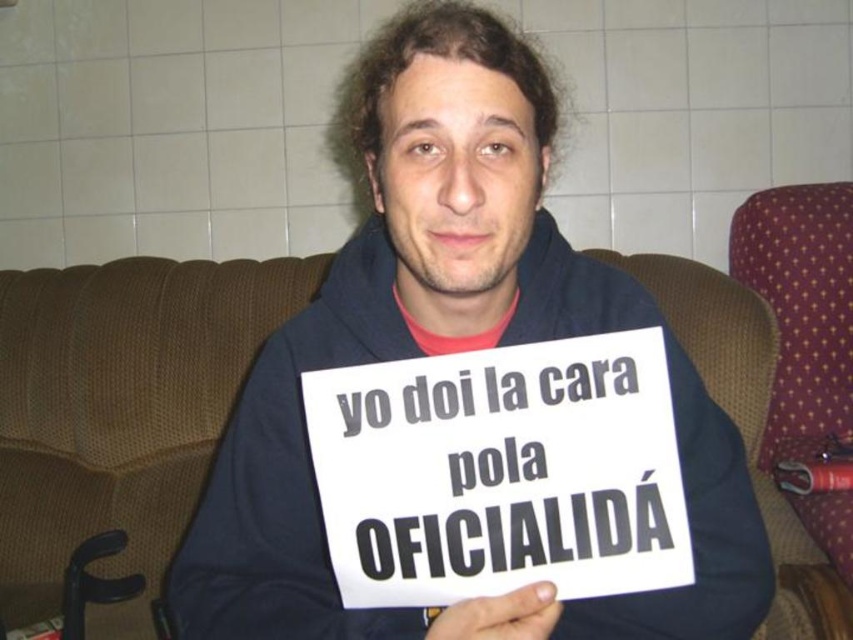
Which is below, dark blue hoodie at center or white paper sign at center?

white paper sign at center is lower down.

How distant is dark blue hoodie at center from white paper sign at center?

dark blue hoodie at center is 5.30 inches from white paper sign at center.

Is point (358, 232) less distant than point (540, 538)?

No, it is not.

Locate an element on the screen. dark blue hoodie at center is located at coordinates (450, 352).